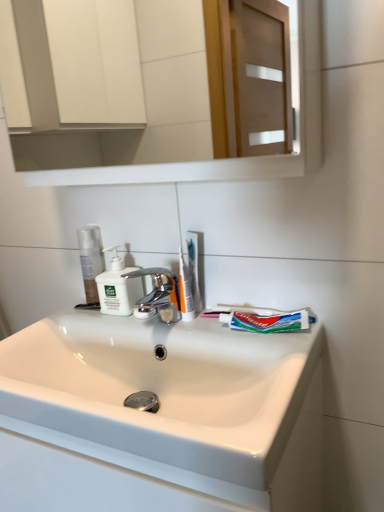
Question: Does green matte toothpaste at center come behind white glossy sink at center?

Choices:
 (A) yes
 (B) no

Answer: (A)

Question: From a real-world perspective, is green matte toothpaste at center on white glossy sink at center?

Choices:
 (A) no
 (B) yes

Answer: (B)

Question: Is green matte toothpaste at center facing towards white glossy sink at center?

Choices:
 (A) no
 (B) yes

Answer: (A)

Question: Considering the relative sizes of green matte toothpaste at center and white glossy sink at center in the image provided, is green matte toothpaste at center wider than white glossy sink at center?

Choices:
 (A) yes
 (B) no

Answer: (B)

Question: Is green matte toothpaste at center positioned with its back to white glossy sink at center?

Choices:
 (A) yes
 (B) no

Answer: (B)

Question: From a real-world perspective, is green matte toothpaste at center physically below white glossy sink at center?

Choices:
 (A) yes
 (B) no

Answer: (B)

Question: Would you say green matte toothpaste at center is part of white matte soap dispenser at center's contents?

Choices:
 (A) yes
 (B) no

Answer: (B)

Question: Is white matte soap dispenser at center turned away from green matte toothpaste at center?

Choices:
 (A) yes
 (B) no

Answer: (B)

Question: Is white matte soap dispenser at center positioned behind green matte toothpaste at center?

Choices:
 (A) yes
 (B) no

Answer: (A)

Question: Considering the relative sizes of white matte soap dispenser at center and green matte toothpaste at center in the image provided, is white matte soap dispenser at center thinner than green matte toothpaste at center?

Choices:
 (A) no
 (B) yes

Answer: (A)

Question: Is white matte soap dispenser at center positioned before green matte toothpaste at center?

Choices:
 (A) no
 (B) yes

Answer: (A)

Question: From the image's perspective, is white matte soap dispenser at center below green matte toothpaste at center?

Choices:
 (A) no
 (B) yes

Answer: (A)

Question: Can you confirm if translucent plastic toothbrush at center is smaller than clear plastic bottle at left?

Choices:
 (A) yes
 (B) no

Answer: (A)